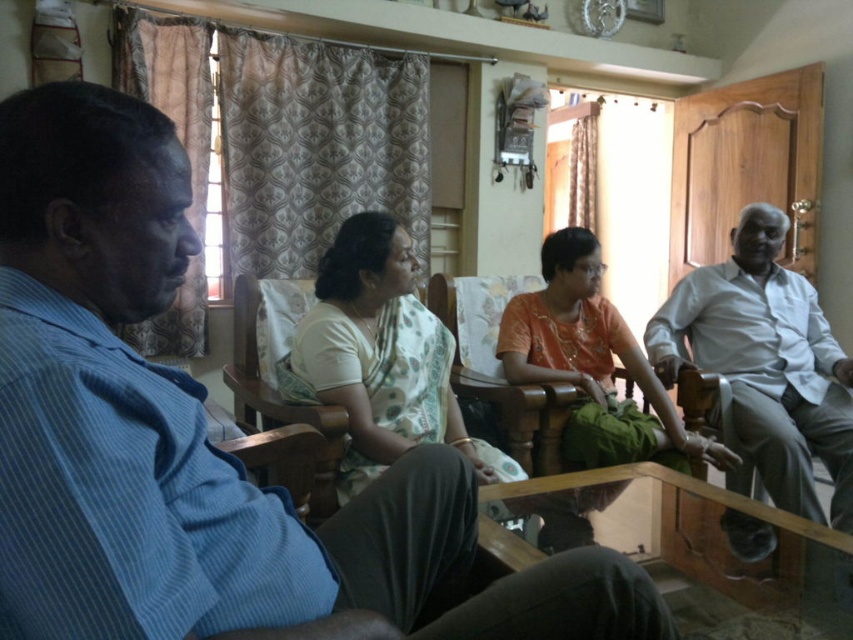
Question: Is white cotton saree at center positioned at the back of orange fabric dress at center?

Choices:
 (A) yes
 (B) no

Answer: (B)

Question: Where is blue striped shirt at left located in relation to white cotton shirt at right in the image?

Choices:
 (A) right
 (B) left

Answer: (B)

Question: Which object appears closest to the camera in this image?

Choices:
 (A) blue striped shirt at left
 (B) white cotton saree at center

Answer: (A)

Question: Which point is closer to the camera taking this photo?

Choices:
 (A) (811, 404)
 (B) (355, 234)

Answer: (B)

Question: Is white cotton saree at center to the left of orange fabric dress at center from the viewer's perspective?

Choices:
 (A) yes
 (B) no

Answer: (A)

Question: Which point appears farthest from the camera in this image?

Choices:
 (A) (448, 360)
 (B) (839, 490)
 (C) (554, 248)

Answer: (C)